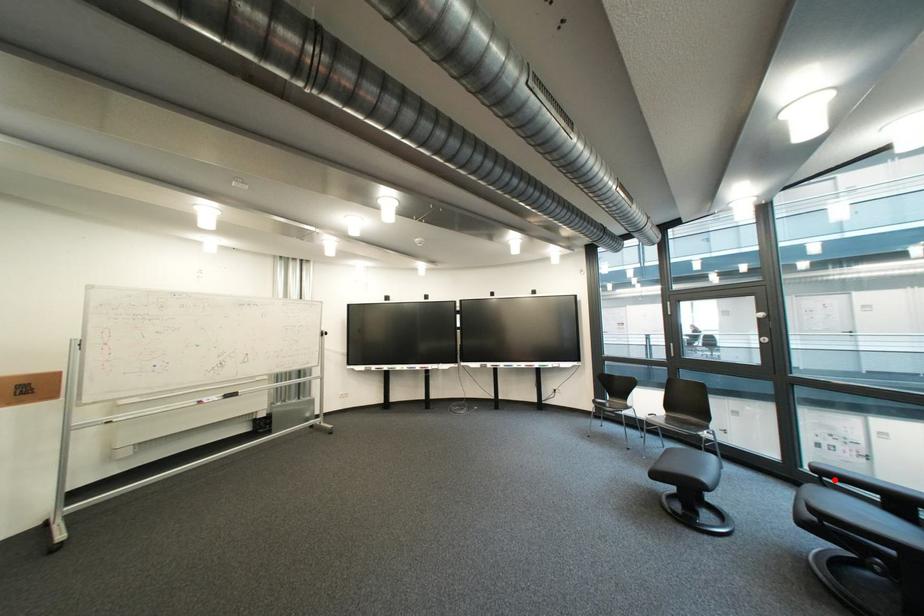
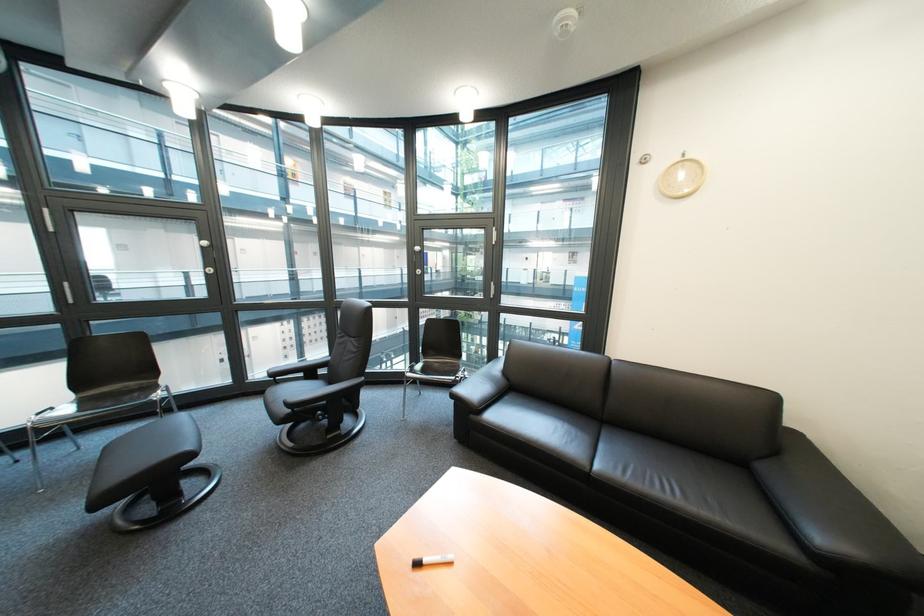
Find the pixel in the second image that matches the highlighted location in the first image.

(287, 381)